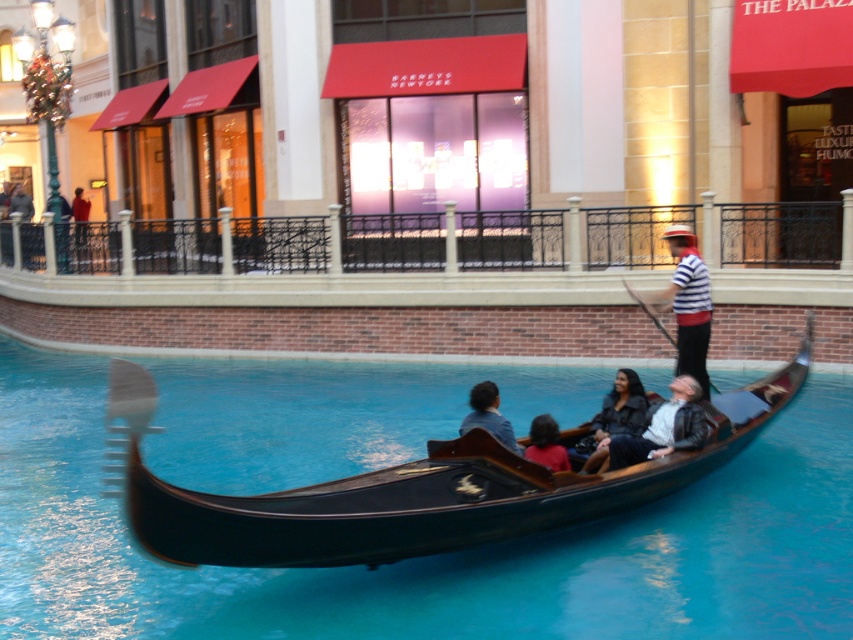
Question: Which of the following is the farthest from the observer?

Choices:
 (A) dark blue fabric shirt at center
 (B) red shirt at upper left

Answer: (B)

Question: Is striped cotton shirt at center to the right of matte red shirt at center from the viewer's perspective?

Choices:
 (A) no
 (B) yes

Answer: (B)

Question: Among these objects, which one is nearest to the camera?

Choices:
 (A) red shirt at upper left
 (B) black polished wood canal at center
 (C) matte red shirt at center

Answer: (B)

Question: Is leather jacket at center smaller than black leather jacket at center?

Choices:
 (A) yes
 (B) no

Answer: (B)

Question: Is dark blue fabric shirt at center wider than red shirt at upper left?

Choices:
 (A) yes
 (B) no

Answer: (B)

Question: Which point is closer to the camera?

Choices:
 (A) (74, 189)
 (B) (699, 294)
 (C) (631, 385)
 (D) (593, 380)

Answer: (C)